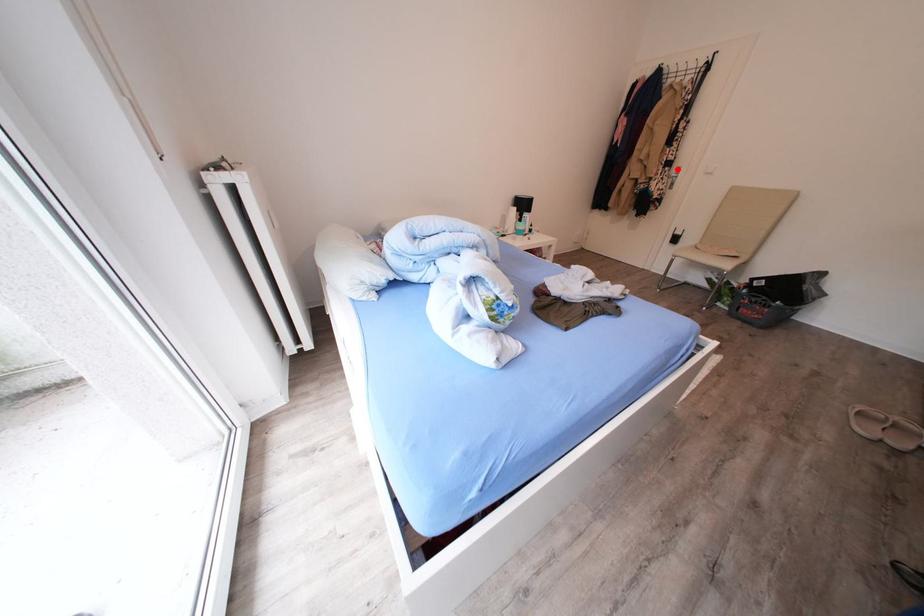
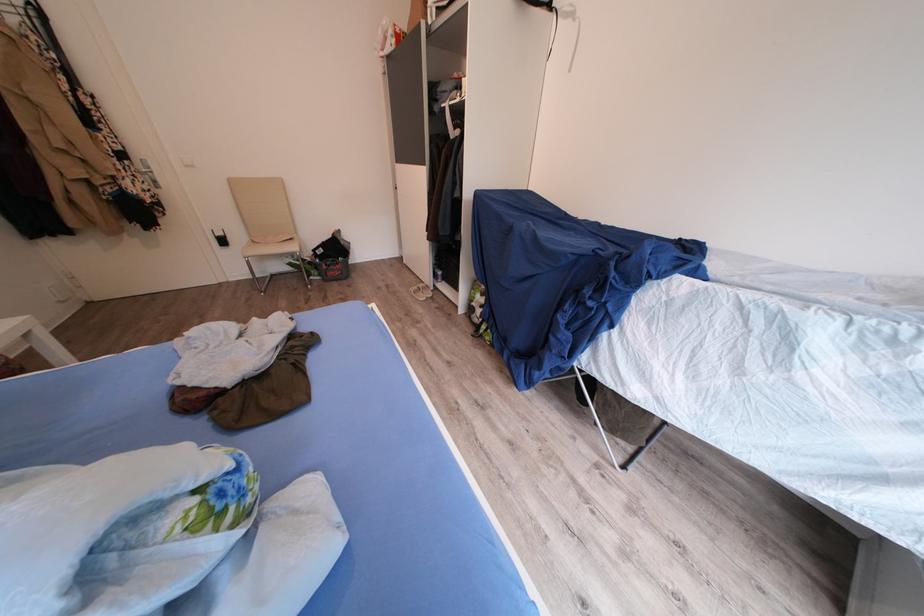
Find the pixel in the second image that matches the highlighted location in the first image.

(130, 161)